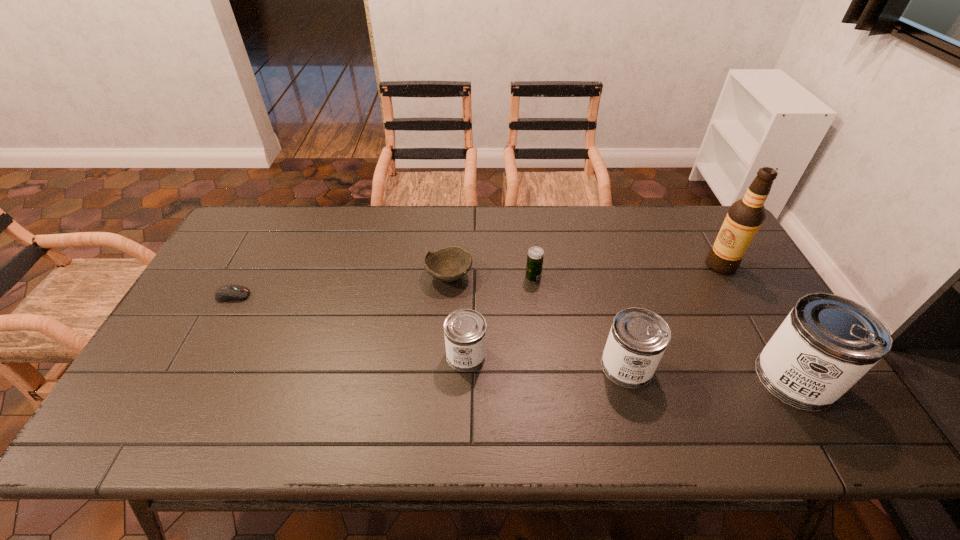
Find the location of a particular element. free space between the third object from right to left and the shortest can is located at coordinates coord(546,360).

Find the location of a particular element. The height and width of the screenshot is (540, 960). vacant space that is in between the shortest object and the second can from right to left is located at coordinates (430, 331).

Find the location of a particular element. The width and height of the screenshot is (960, 540). free point between the second tallest object and the alcohol is located at coordinates (757, 321).

I want to click on vacant area that lies between the alcohol and the leftmost can, so click(593, 310).

What are the coordinates of `vacant area that lies between the leftmost object and the second shortest can` in the screenshot? It's located at (430, 331).

The image size is (960, 540). I want to click on free space between the tallest object and the fifth shortest object, so click(x=674, y=315).

Find the location of a particular element. The width and height of the screenshot is (960, 540). object that is the closest to the fourth object from left to right is located at coordinates (449, 264).

This screenshot has width=960, height=540. In order to click on the fourth closest object to the shortest can in this screenshot , I will do `click(231, 292)`.

Find the location of a particular element. The height and width of the screenshot is (540, 960). the third closest can to the shortest object is located at coordinates (827, 343).

What are the coordinates of `the closest can to the bowl` in the screenshot? It's located at (465, 330).